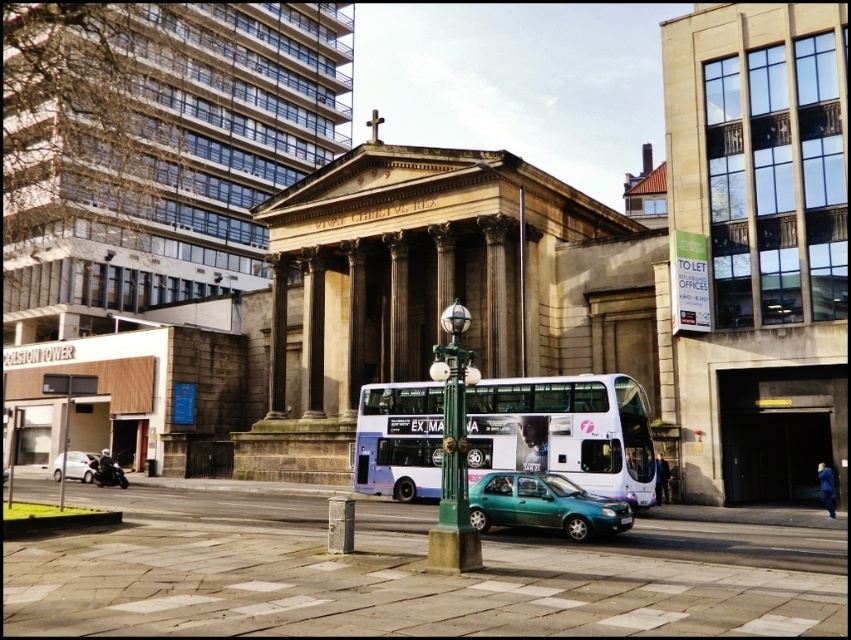
Question: Which point is farther to the camera?

Choices:
 (A) (80, 477)
 (B) (533, 508)
 (C) (577, 445)
 (D) (446, 324)

Answer: (A)

Question: Which point is farther from the camera taking this photo?

Choices:
 (A) click(80, 467)
 (B) click(520, 508)
 (C) click(490, 381)
 (D) click(446, 541)

Answer: (A)

Question: Is blue metallic bus at center above teal matte hatchback at center?

Choices:
 (A) no
 (B) yes

Answer: (B)

Question: Is green polished metal streetlight at center bigger than teal matte hatchback at center?

Choices:
 (A) yes
 (B) no

Answer: (A)

Question: Which point is farther to the camera?

Choices:
 (A) green polished metal streetlight at center
 (B) silver metallic car at lower left
 (C) teal matte hatchback at center

Answer: (B)

Question: Does teal matte hatchback at center have a smaller size compared to silver metallic car at lower left?

Choices:
 (A) yes
 (B) no

Answer: (A)